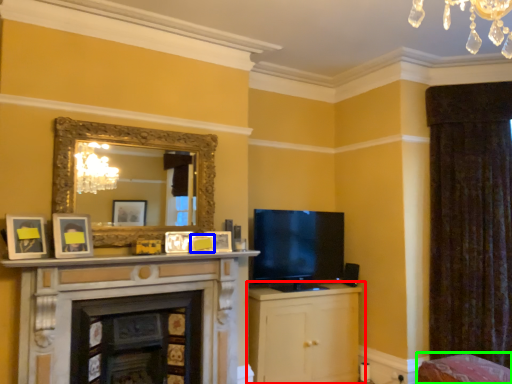
Question: Which object is the closest to the cabinetry (highlighted by a red box)? Choose among these: picture frame (highlighted by a blue box) or swivel chair (highlighted by a green box).

Choices:
 (A) picture frame
 (B) swivel chair

Answer: (B)